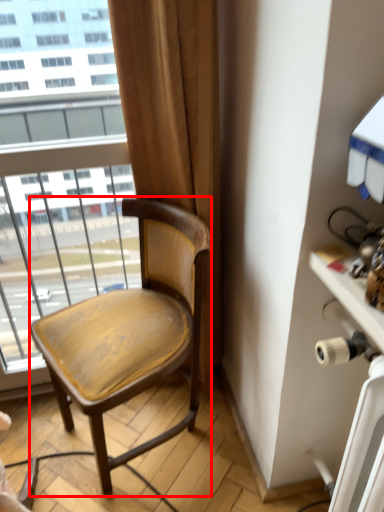
Question: Considering the relative positions of chair (annotated by the red box) and table in the image provided, where is chair (annotated by the red box) located with respect to the staircase?

Choices:
 (A) right
 (B) left

Answer: (B)